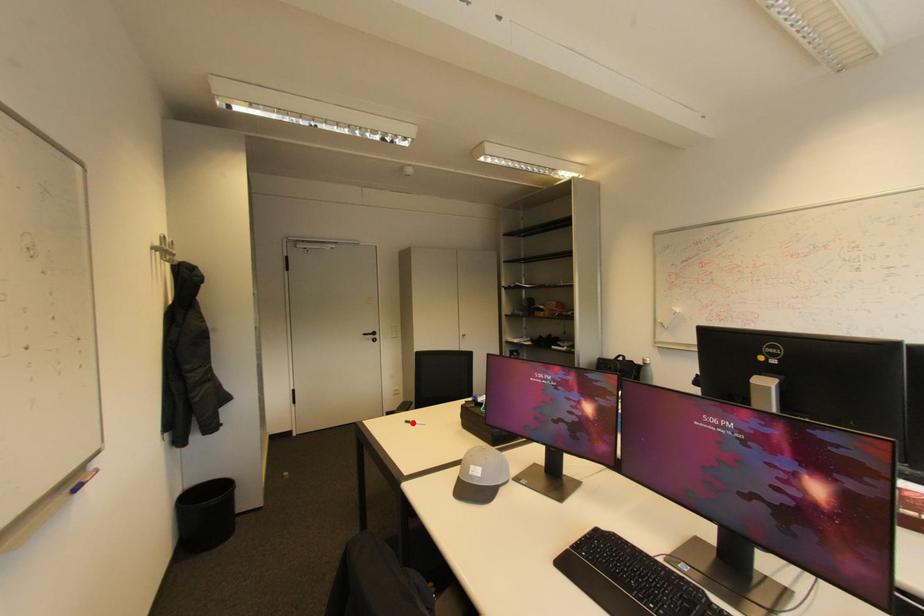
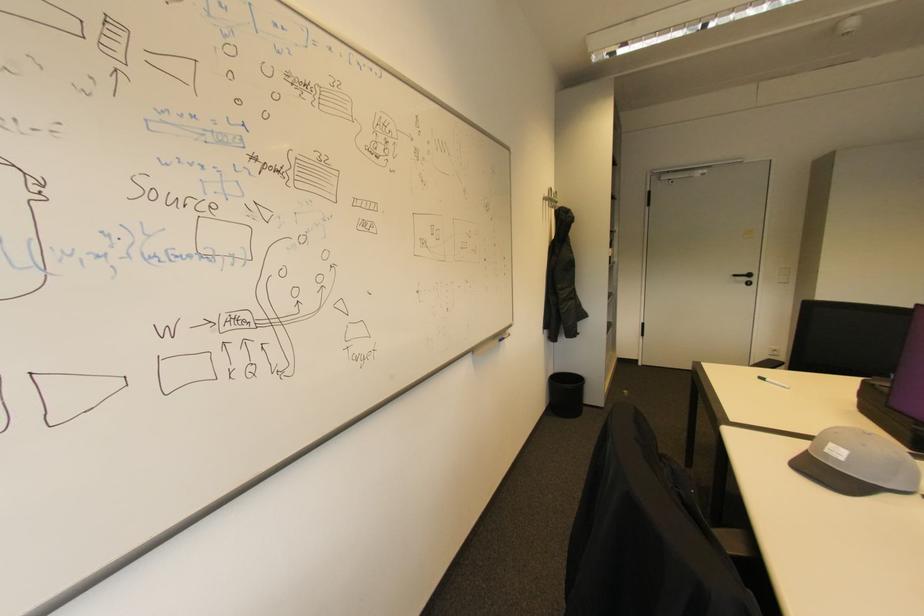
In the second image, find the point that corresponds to the highlighted location in the first image.

(768, 379)